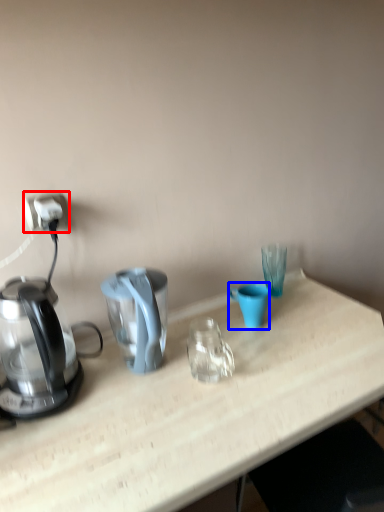
Question: Which object is further to the camera taking this photo, power outlet (highlighted by a red box) or coffee cup (highlighted by a blue box)?

Choices:
 (A) power outlet
 (B) coffee cup

Answer: (B)